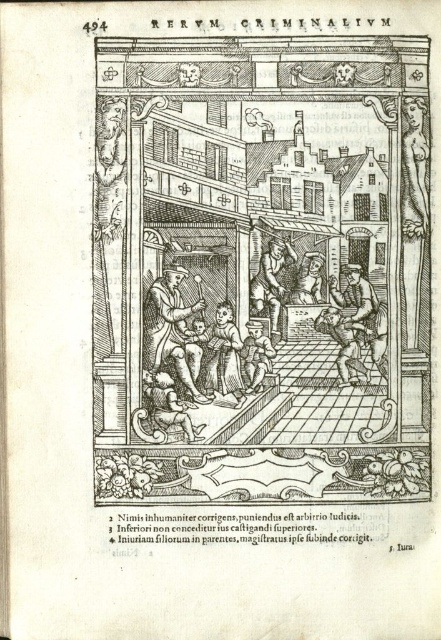
Question: Is wooden staff at center bigger than wooden chair at center?

Choices:
 (A) no
 (B) yes

Answer: (B)

Question: Is wooden staff at center below wooden chair at center?

Choices:
 (A) no
 (B) yes

Answer: (B)

Question: Which point is farther to the camera?

Choices:
 (A) wooden chair at center
 (B) wooden staff at center

Answer: (A)

Question: In this image, where is wooden staff at center located relative to wooden chair at center?

Choices:
 (A) right
 (B) left

Answer: (B)

Question: Which object is closer to the camera taking this photo?

Choices:
 (A) wooden chair at center
 (B) wooden staff at center

Answer: (B)